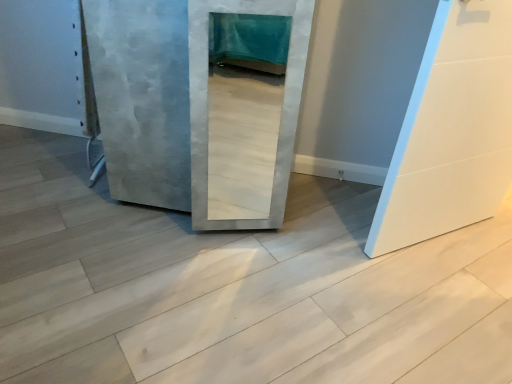
Question: Is concreteroughconcrete at center bigger than white matte door at right, placed as the 1th door when sorted from right to left?

Choices:
 (A) no
 (B) yes

Answer: (B)

Question: Considering the relative sizes of concreteroughconcrete at center and white matte door at right, the second door in the left-to-right sequence, in the image provided, is concreteroughconcrete at center wider than white matte door at right, the second door in the left-to-right sequence,?

Choices:
 (A) yes
 (B) no

Answer: (A)

Question: Is concreteroughconcrete at center thinner than white matte door at right, placed as the 1th door when sorted from right to left?

Choices:
 (A) yes
 (B) no

Answer: (B)

Question: From the image's perspective, is concreteroughconcrete at center on white matte door at right, the second door in the left-to-right sequence?

Choices:
 (A) yes
 (B) no

Answer: (B)

Question: Would you say concreteroughconcrete at center is a long distance from white matte door at right, placed as the 1th door when sorted from right to left?

Choices:
 (A) no
 (B) yes

Answer: (A)

Question: In terms of width, does concrete textured door at center, which is counted as the first door, starting from the left, look wider or thinner when compared to concreteroughconcrete at center?

Choices:
 (A) thin
 (B) wide

Answer: (A)

Question: Visually, is concrete textured door at center, which is counted as the first door, starting from the left, positioned to the left or to the right of concreteroughconcrete at center?

Choices:
 (A) left
 (B) right

Answer: (A)

Question: Is concrete textured door at center, which is counted as the first door, starting from the left, inside the boundaries of concreteroughconcrete at center, or outside?

Choices:
 (A) inside
 (B) outside

Answer: (B)

Question: Does point (112, 84) appear closer or farther from the camera than point (478, 352)?

Choices:
 (A) closer
 (B) farther

Answer: (B)

Question: From a real-world perspective, is concrete textured door at center, which is the 2th door in right-to-left order, positioned above or below white matte door at right, the second door in the left-to-right sequence?

Choices:
 (A) below
 (B) above

Answer: (A)

Question: From their relative heights in the image, would you say concrete textured door at center, which is the 2th door in right-to-left order, is taller or shorter than white matte door at right, placed as the 1th door when sorted from right to left?

Choices:
 (A) short
 (B) tall

Answer: (A)

Question: In the image, is concrete textured door at center, which is counted as the first door, starting from the left, on the left side or the right side of white matte door at right, the second door in the left-to-right sequence?

Choices:
 (A) left
 (B) right

Answer: (A)

Question: Considering the positions of concrete textured door at center, which is counted as the first door, starting from the left, and white matte door at right, the second door in the left-to-right sequence, in the image, is concrete textured door at center, which is counted as the first door, starting from the left, bigger or smaller than white matte door at right, the second door in the left-to-right sequence,?

Choices:
 (A) small
 (B) big

Answer: (B)

Question: Considering their positions, is white matte door at right, placed as the 1th door when sorted from right to left, located in front of or behind concreteroughconcrete at center?

Choices:
 (A) front
 (B) behind

Answer: (B)

Question: Considering the positions of white matte door at right, the second door in the left-to-right sequence, and concreteroughconcrete at center in the image, is white matte door at right, the second door in the left-to-right sequence, wider or thinner than concreteroughconcrete at center?

Choices:
 (A) wide
 (B) thin

Answer: (B)